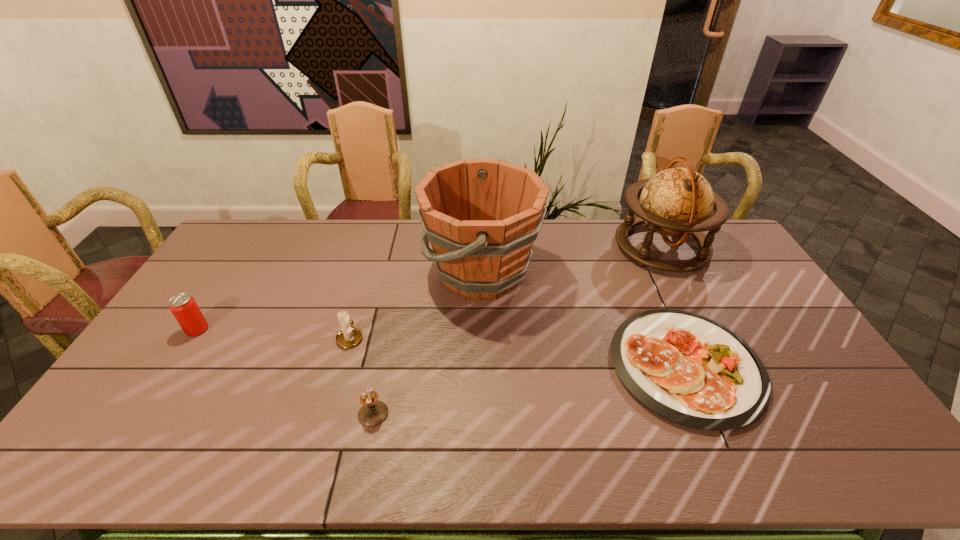
I want to click on object present at the near edge, so click(x=689, y=369).

Find the location of a particular element. This screenshot has height=540, width=960. object that is at the left edge is located at coordinates (183, 306).

Where is `object that is at the right edge`? The image size is (960, 540). object that is at the right edge is located at coordinates (676, 202).

At what (x,y) coordinates should I click in order to perform the action: click on object positioned at the far right corner. Please return your answer as a coordinate pair (x, y). Looking at the image, I should click on (676, 202).

The image size is (960, 540). What are the coordinates of `free space at the far edge of the desktop` in the screenshot? It's located at point(593,250).

Identify the location of vacant position at the near edge of the desktop. This screenshot has width=960, height=540. (166, 444).

Where is `vacant space at the left edge`? This screenshot has height=540, width=960. vacant space at the left edge is located at coordinates (94, 427).

Find the location of `vacant space at the right edge of the desktop`. vacant space at the right edge of the desktop is located at coordinates (790, 327).

Image resolution: width=960 pixels, height=540 pixels. In the image, there is a desktop. In order to click on free space at the far left corner in this screenshot , I will do `click(228, 256)`.

At what (x,y) coordinates should I click in order to perform the action: click on vacant point located between the globe and the nearer candle holder. Please return your answer as a coordinate pair (x, y). Looking at the image, I should click on coord(517,330).